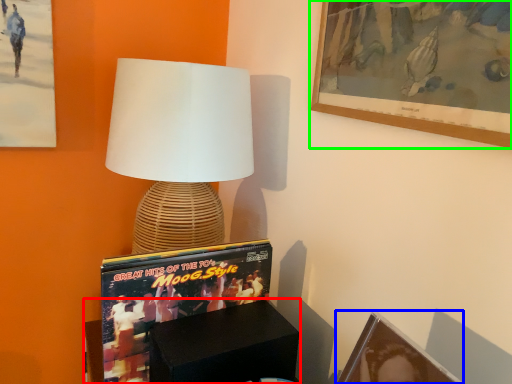
Question: Which object is the farthest from furniture (highlighted by a red box)? Choose among these: picture frame (highlighted by a blue box) or picture frame (highlighted by a green box).

Choices:
 (A) picture frame
 (B) picture frame

Answer: (B)